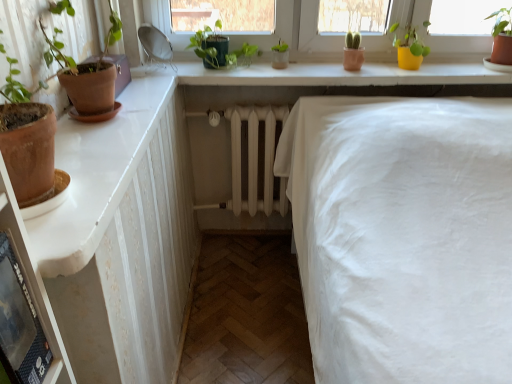
I want to click on free point behind green matte flowerpot at center, so click(279, 63).